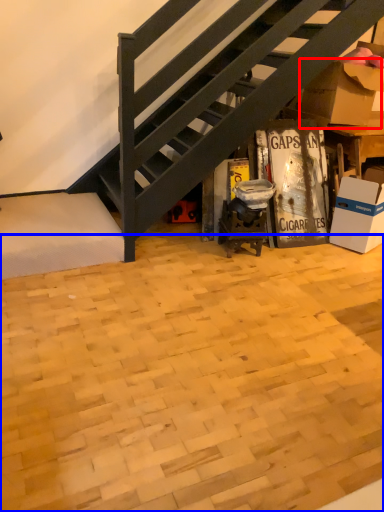
Question: Which of the following is the closest to the observer, cardboard box (highlighted by a red box) or plywood (highlighted by a blue box)?

Choices:
 (A) cardboard box
 (B) plywood

Answer: (B)